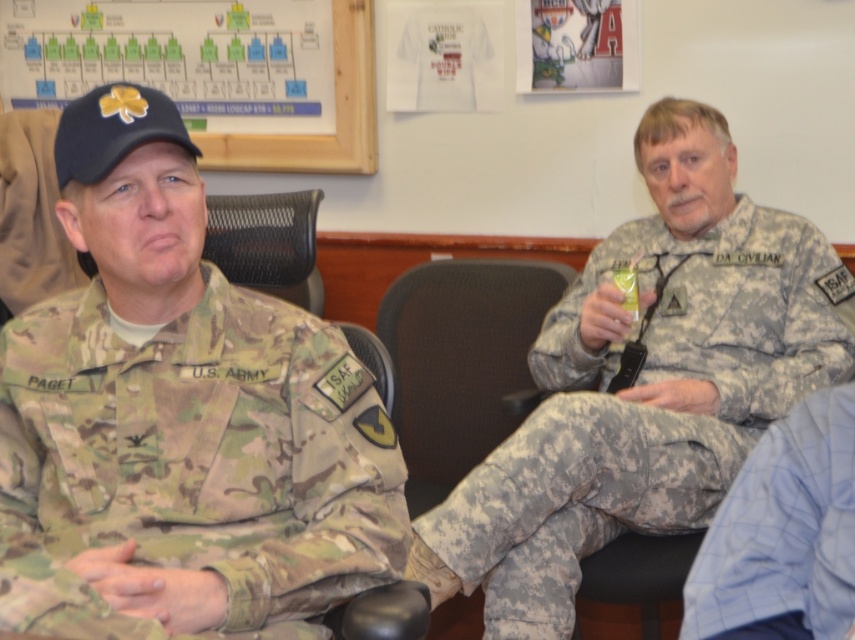
Question: Which of these objects is positioned farthest from the camouflage uniform at left?

Choices:
 (A) blue plaid shirt at lower right
 (B) wooden frame at upper left

Answer: (B)

Question: Is camouflage uniform at left above wooden frame at upper left?

Choices:
 (A) no
 (B) yes

Answer: (A)

Question: Which point appears closest to the camera in this image?

Choices:
 (A) (168, 225)
 (B) (228, 147)
 (C) (553, 392)
 (D) (811, 513)

Answer: (D)

Question: Is blue plaid shirt at lower right closer to camera compared to wooden frame at upper left?

Choices:
 (A) yes
 (B) no

Answer: (A)

Question: From the image, what is the correct spatial relationship of camouflage uniform at left in relation to wooden frame at upper left?

Choices:
 (A) above
 (B) below

Answer: (B)

Question: Which of the following is the closest to the observer?

Choices:
 (A) camouflage fabric uniform at right
 (B) wooden frame at upper left
 (C) blue plaid shirt at lower right

Answer: (C)